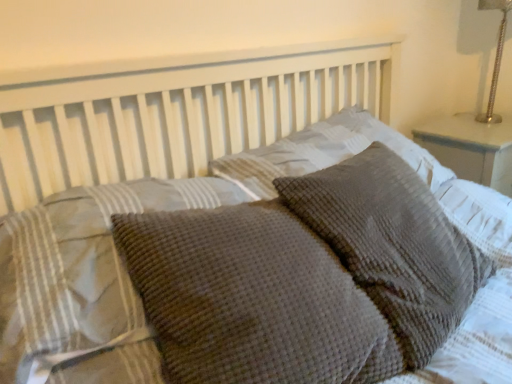
Question: In terms of size, does waffle-textured gray pillow at center, the fourth pillow viewed from the left, appear bigger or smaller than waffle-textured gray pillow at center, the 1th pillow viewed from the left?

Choices:
 (A) small
 (B) big

Answer: (B)

Question: From a real-world perspective, is waffle-textured gray pillow at center, which is counted as the 1th pillow, starting from the right, physically located above or below waffle-textured gray pillow at center, the 1th pillow viewed from the left?

Choices:
 (A) below
 (B) above

Answer: (A)

Question: Estimate the real-world distances between objects in this image. Which object is farther from the waffle-textured gray pillow at center, the 1th pillow viewed from the left?

Choices:
 (A) woolen textured pillow at center, the 2th pillow positioned from the left
 (B) waffle-textured gray pillow at center, the 2th pillow when ordered from right to left
 (C) silver metallic lamp at upper right
 (D) waffle-textured gray pillow at center, the fourth pillow viewed from the left

Answer: (C)

Question: Estimate the real-world distances between objects in this image. Which object is closer to the silver metallic lamp at upper right?

Choices:
 (A) waffle-textured gray pillow at center, the 2th pillow when ordered from right to left
 (B) woolen textured pillow at center, the 2th pillow positioned from the left
 (C) waffle-textured gray pillow at center, which is counted as the 1th pillow, starting from the right
 (D) waffle-textured gray pillow at center, which ranks as the 4th pillow in right-to-left order

Answer: (A)